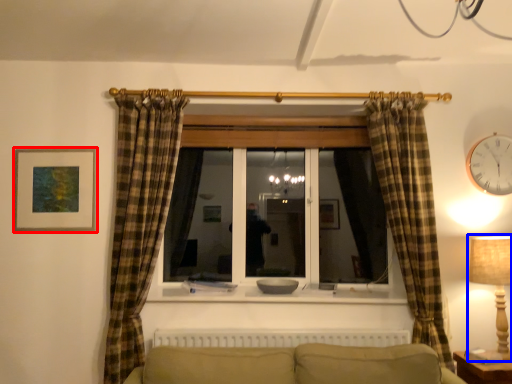
Question: Which of the following is the closest to the observer, picture frame (highlighted by a red box) or table lamp (highlighted by a blue box)?

Choices:
 (A) picture frame
 (B) table lamp

Answer: (B)